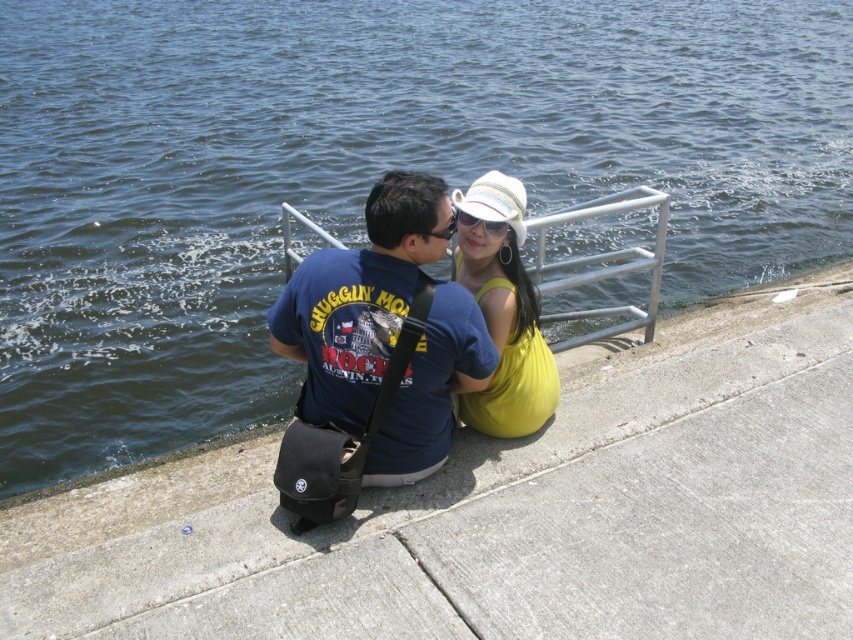
Question: Does yellow fabric dress at center appear on the left side of sunglasses at center?

Choices:
 (A) no
 (B) yes

Answer: (B)

Question: Is concrete at lower center positioned at the back of blue cotton t-shirt at center?

Choices:
 (A) yes
 (B) no

Answer: (B)

Question: Which point is closer to the camera taking this photo?

Choices:
 (A) (503, 173)
 (B) (456, 221)
 (C) (370, 468)

Answer: (B)

Question: Which object is closer to the camera taking this photo?

Choices:
 (A) white woven baseball hat at center
 (B) sunglasses at center
 (C) concrete at lower center

Answer: (C)

Question: Which point appears farthest from the camera in this image?

Choices:
 (A) (426, 173)
 (B) (495, 216)

Answer: (B)

Question: Is yellow fabric dress at center to the right of sunglasses at center from the viewer's perspective?

Choices:
 (A) no
 (B) yes

Answer: (A)